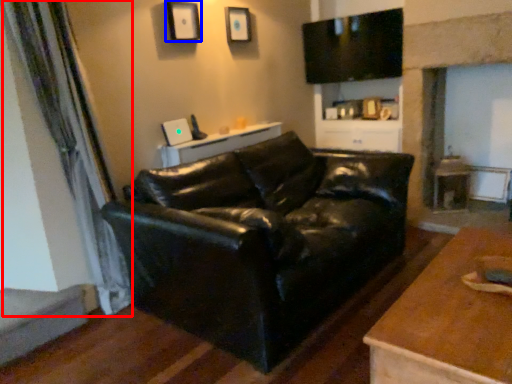
Question: Which of the following is the farthest to the observer, curtain (highlighted by a red box) or picture frame (highlighted by a blue box)?

Choices:
 (A) curtain
 (B) picture frame

Answer: (B)